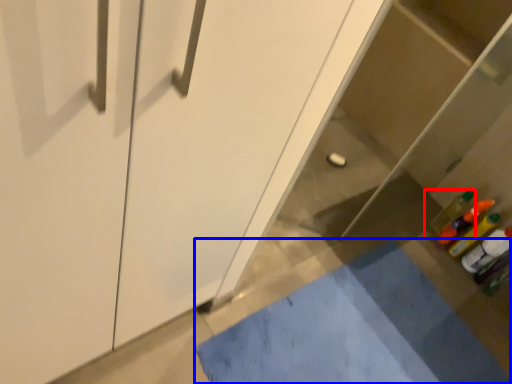
Question: Which object appears closest to the camera in this image, bottle (highlighted by a red box) or bath mat (highlighted by a blue box)?

Choices:
 (A) bottle
 (B) bath mat

Answer: (B)